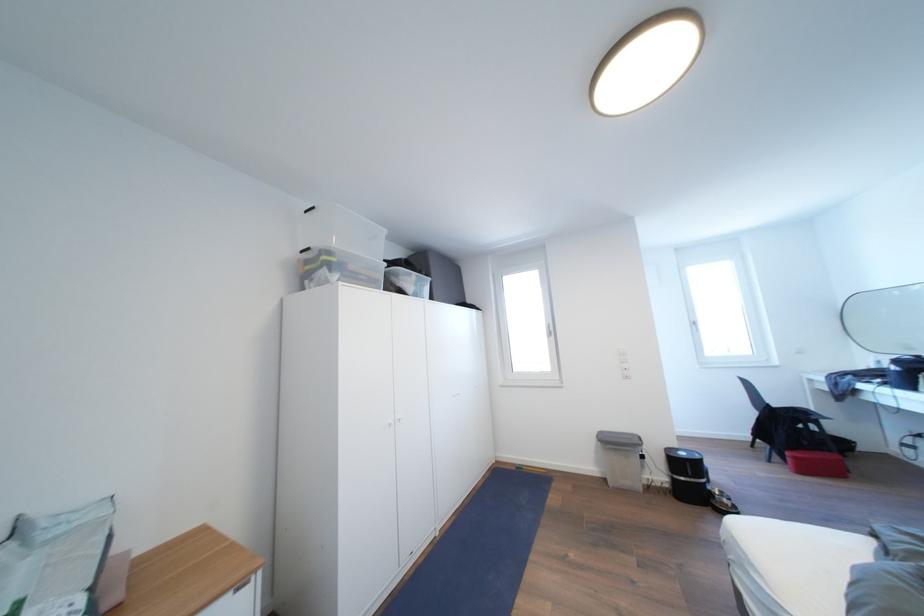
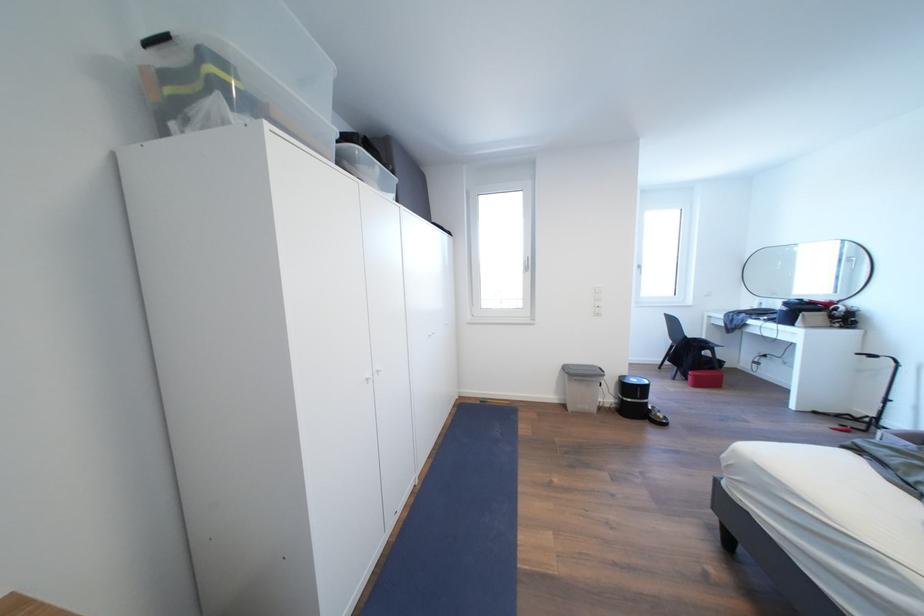
The point at (689, 459) is marked in the first image. Where is the corresponding point in the second image?

(641, 386)